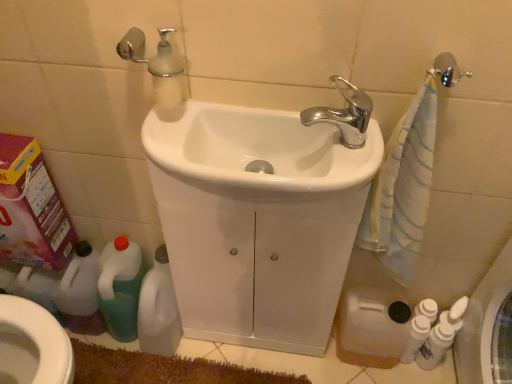
Question: Considering the relative sizes of white glossy bottles at lower right, positioned as the second cleaning product in right-to-left order, and white glossy sink at center, the second sink in the back-to-front sequence, in the image provided, is white glossy bottles at lower right, positioned as the second cleaning product in right-to-left order, shorter than white glossy sink at center, the second sink in the back-to-front sequence,?

Choices:
 (A) yes
 (B) no

Answer: (B)

Question: Would you say white glossy bottles at lower right, positioned as the second cleaning product in right-to-left order, contains white glossy sink at center, the second sink in the back-to-front sequence?

Choices:
 (A) no
 (B) yes

Answer: (A)

Question: From a real-world perspective, is white glossy bottles at lower right, which is counted as the 3th cleaning product, starting from the left, on top of white glossy sink at center, the second sink in the back-to-front sequence?

Choices:
 (A) no
 (B) yes

Answer: (A)

Question: Does white glossy bottles at lower right, which is counted as the 3th cleaning product, starting from the left, lie in front of white glossy sink at center, the second sink in the back-to-front sequence?

Choices:
 (A) no
 (B) yes

Answer: (A)

Question: From the image's perspective, is white glossy bottles at lower right, which is counted as the 3th cleaning product, starting from the left, located beneath white glossy sink at center, the second sink in the back-to-front sequence?

Choices:
 (A) no
 (B) yes

Answer: (B)

Question: Considering the positions of green plastic bottle at lower left, the 4th cleaning product positioned from the right, and white glossy bottles at lower right, which is counted as the 3th cleaning product, starting from the left, in the image, is green plastic bottle at lower left, the 4th cleaning product positioned from the right, bigger or smaller than white glossy bottles at lower right, which is counted as the 3th cleaning product, starting from the left,?

Choices:
 (A) small
 (B) big

Answer: (B)

Question: From a real-world perspective, relative to white glossy bottles at lower right, positioned as the second cleaning product in right-to-left order, is green plastic bottle at lower left, the 4th cleaning product positioned from the right, vertically above or below?

Choices:
 (A) above
 (B) below

Answer: (A)

Question: In terms of height, does green plastic bottle at lower left, which is the first cleaning product in left-to-right order, look taller or shorter compared to white glossy bottles at lower right, positioned as the second cleaning product in right-to-left order?

Choices:
 (A) tall
 (B) short

Answer: (A)

Question: Is green plastic bottle at lower left, the 4th cleaning product positioned from the right, to the left or to the right of white glossy bottles at lower right, positioned as the second cleaning product in right-to-left order, in the image?

Choices:
 (A) right
 (B) left

Answer: (B)

Question: Is pink cardboard box at left inside or outside of green plastic bottle at lower left, the 4th cleaning product positioned from the right?

Choices:
 (A) inside
 (B) outside

Answer: (B)

Question: In the image, is pink cardboard box at left positioned in front of or behind green plastic bottle at lower left, the 4th cleaning product positioned from the right?

Choices:
 (A) front
 (B) behind

Answer: (A)

Question: Visually, is pink cardboard box at left positioned to the left or to the right of green plastic bottle at lower left, which is the first cleaning product in left-to-right order?

Choices:
 (A) left
 (B) right

Answer: (A)

Question: Is pink cardboard box at left wider or thinner than green plastic bottle at lower left, which is the first cleaning product in left-to-right order?

Choices:
 (A) thin
 (B) wide

Answer: (A)

Question: In terms of width, does white glossy bidet at lower left look wider or thinner when compared to green plastic bottle at lower left, which is the first cleaning product in left-to-right order?

Choices:
 (A) thin
 (B) wide

Answer: (A)

Question: Is white glossy bidet at lower left in front of or behind green plastic bottle at lower left, the 4th cleaning product positioned from the right, in the image?

Choices:
 (A) behind
 (B) front

Answer: (B)